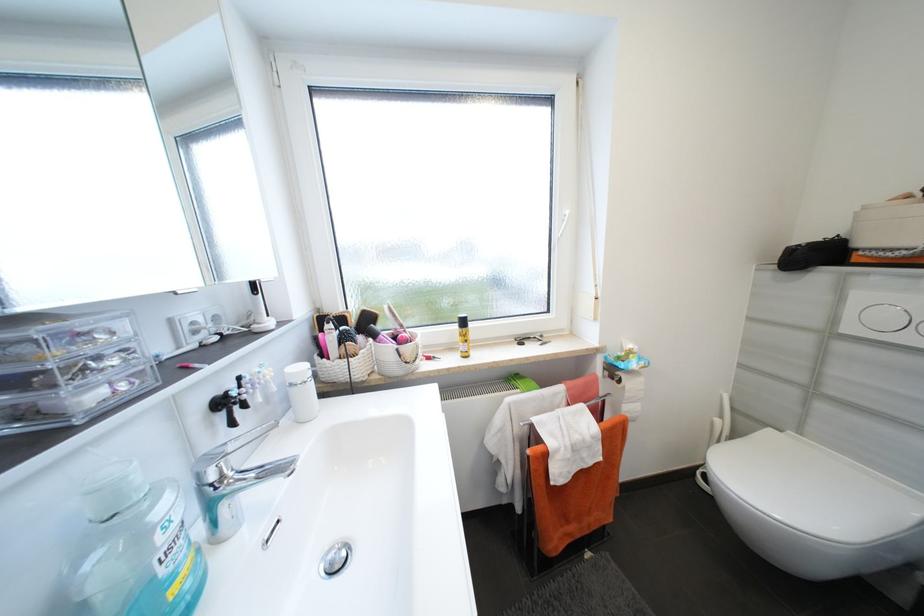
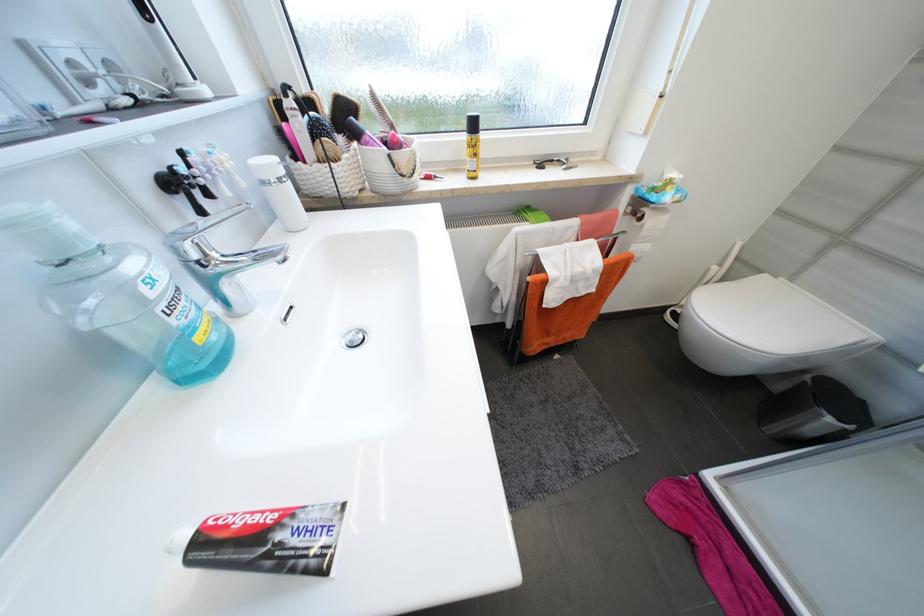
Locate, in the second image, the point that corresponds to pixel 143 479 in the first image.

(78, 227)